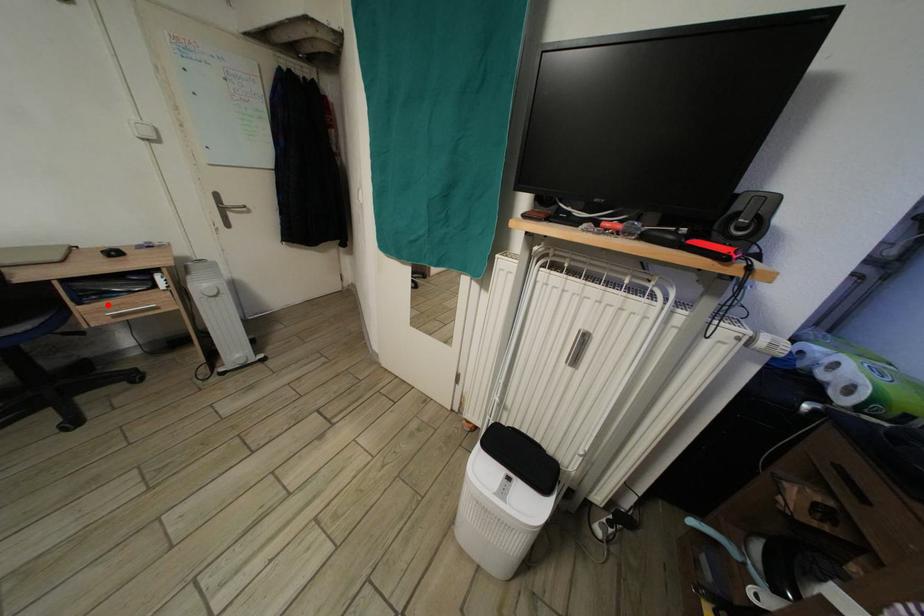
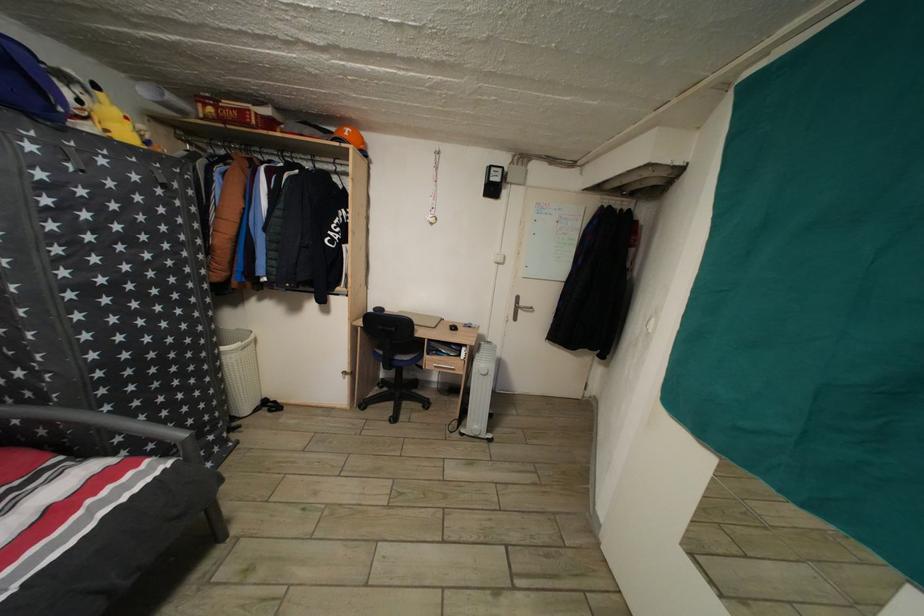
Question: A red point is marked in image1. In image2, is the corresponding 3D point closer to the camera or farther? Reply with the corresponding letter.

Choices:
 (A) The corresponding 3D point is closer.
 (B) The corresponding 3D point is farther.

Answer: (B)